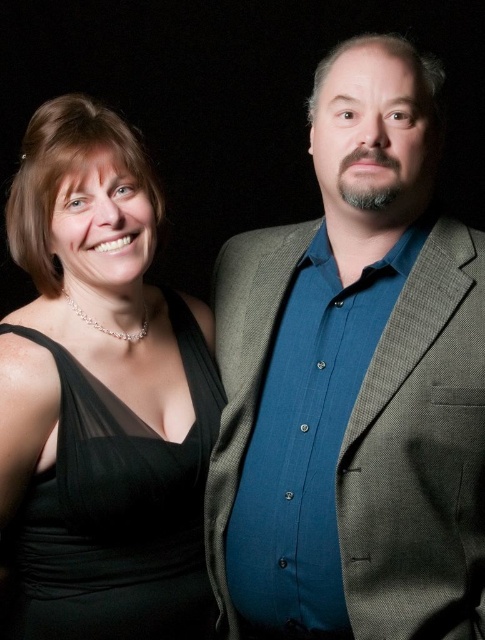
Question: Can you confirm if textured gray blazer at center is bigger than black satin dress at left?

Choices:
 (A) no
 (B) yes

Answer: (B)

Question: Considering the relative positions of textured gray blazer at center and black satin dress at left in the image provided, where is textured gray blazer at center located with respect to black satin dress at left?

Choices:
 (A) above
 (B) below

Answer: (A)

Question: Does textured gray blazer at center appear under black satin dress at left?

Choices:
 (A) no
 (B) yes

Answer: (A)

Question: Among these points, which one is farthest from the camera?

Choices:
 (A) (348, 369)
 (B) (4, 634)

Answer: (B)